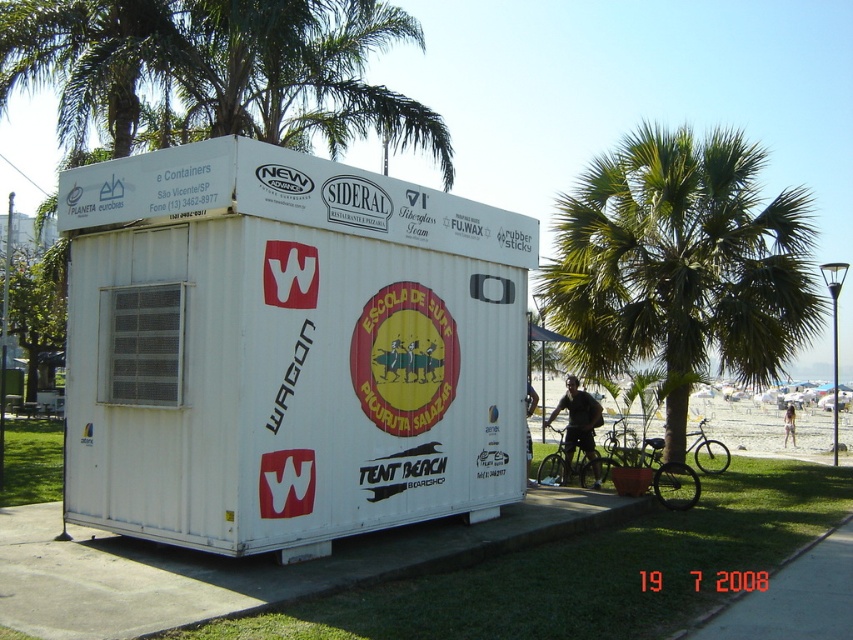
You are a delivery person who needs to place a large package on the white matte shipping container at center and the dark brown leather jacket at center. Which object can the package be placed on?

The white matte shipping container at center is bigger than the dark brown leather jacket at center, so the package can be placed on the white matte shipping container at center.

You are a delivery person who needs to place a dark brown leather jacket at center on the ground near the white matte shipping container at center. However, the shipping container is currently blocking the jacket. Can you move the jacket to the side so it doesn not block the entrance of the container?

The white matte shipping container at center is positioned over dark brown leather jacket at center, meaning the jacket is underneath the container. Since the container is a large, immovable structure, you cannot move it to access the jacket. You would need to relocate the jacket from another accessible point or request assistance to move the container temporarily.